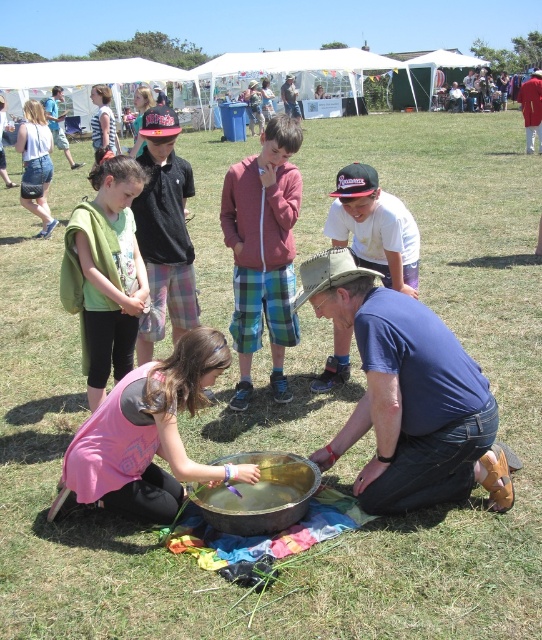
You are standing at the center of the image and want to locate the red fabric shirt at upper right. In which direction should you look to find it?

The red fabric shirt at upper right is located at point (x=532, y=109), so you should look towards the upper right direction to find it.

You are standing at the position of the young girl holding the purple object over the large metal bowl. You need to hand the purple object to the older man wearing the blue cotton shirt at center. Can you reach him without moving from your current position?

The distance between the young girl and the older man wearing the blue cotton shirt at center is 3.10 meters, so you cannot reach him without moving since the typical human arm length is around 0.7 meters.